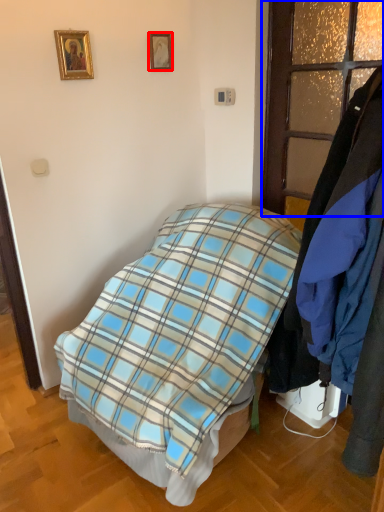
Question: Among these objects, which one is farthest to the camera, picture frame (highlighted by a red box) or glass door (highlighted by a blue box)?

Choices:
 (A) picture frame
 (B) glass door

Answer: (A)